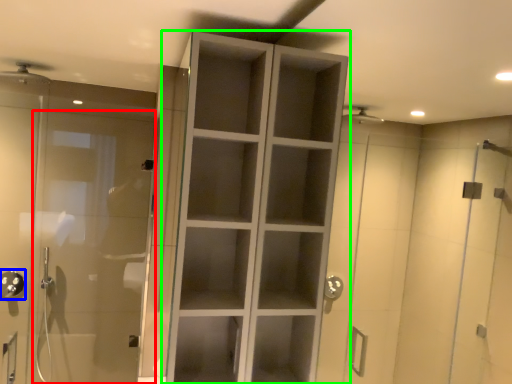
Question: Which object is positioned farthest from door (highlighted by a red box)? Select from shower (highlighted by a blue box) and cupboard (highlighted by a green box).

Choices:
 (A) shower
 (B) cupboard

Answer: (B)